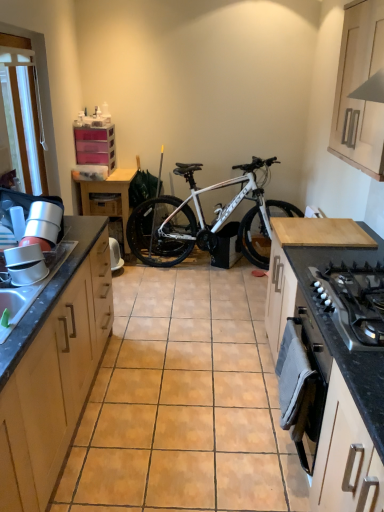
Question: Is white plastic screen door at upper left oriented away from wooden drawer at center?

Choices:
 (A) no
 (B) yes

Answer: (A)

Question: Considering the relative sizes of white plastic screen door at upper left and wooden drawer at center in the image provided, is white plastic screen door at upper left smaller than wooden drawer at center?

Choices:
 (A) no
 (B) yes

Answer: (A)

Question: From a real-world perspective, does white plastic screen door at upper left stand above wooden drawer at center?

Choices:
 (A) no
 (B) yes

Answer: (B)

Question: Is white plastic screen door at upper left next to wooden drawer at center and touching it?

Choices:
 (A) no
 (B) yes

Answer: (A)

Question: Would you consider white plastic screen door at upper left to be distant from wooden drawer at center?

Choices:
 (A) no
 (B) yes

Answer: (B)

Question: Is white plastic screen door at upper left not within wooden drawer at center?

Choices:
 (A) yes
 (B) no

Answer: (A)

Question: From the image's perspective, would you say white plastic screen door at upper left is shown under wooden cabinet at left, which is the second cabinetry from front to back?

Choices:
 (A) yes
 (B) no

Answer: (B)

Question: Is white plastic screen door at upper left positioned with its back to wooden cabinet at left, the 3th cabinetry viewed from the right?

Choices:
 (A) no
 (B) yes

Answer: (A)

Question: Is white plastic screen door at upper left placed right next to wooden cabinet at left, the second cabinetry positioned from the left?

Choices:
 (A) yes
 (B) no

Answer: (B)

Question: From a real-world perspective, is white plastic screen door at upper left below wooden cabinet at left, the 3th cabinetry viewed from the right?

Choices:
 (A) yes
 (B) no

Answer: (B)

Question: Can you confirm if white plastic screen door at upper left is bigger than wooden cabinet at left, which is the second cabinetry from front to back?

Choices:
 (A) yes
 (B) no

Answer: (B)

Question: Is white plastic screen door at upper left wider than wooden cabinet at left, the second cabinetry positioned from the left?

Choices:
 (A) no
 (B) yes

Answer: (A)

Question: Is white glossy cabinet at lower right, which appears as the second cabinetry when viewed from the right, positioned beyond the bounds of wooden drawer at center?

Choices:
 (A) no
 (B) yes

Answer: (B)